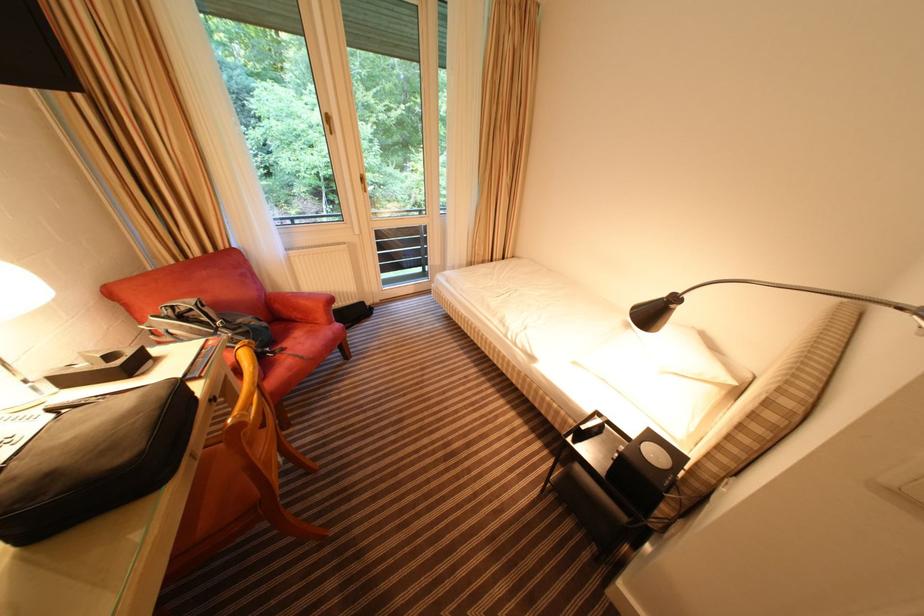
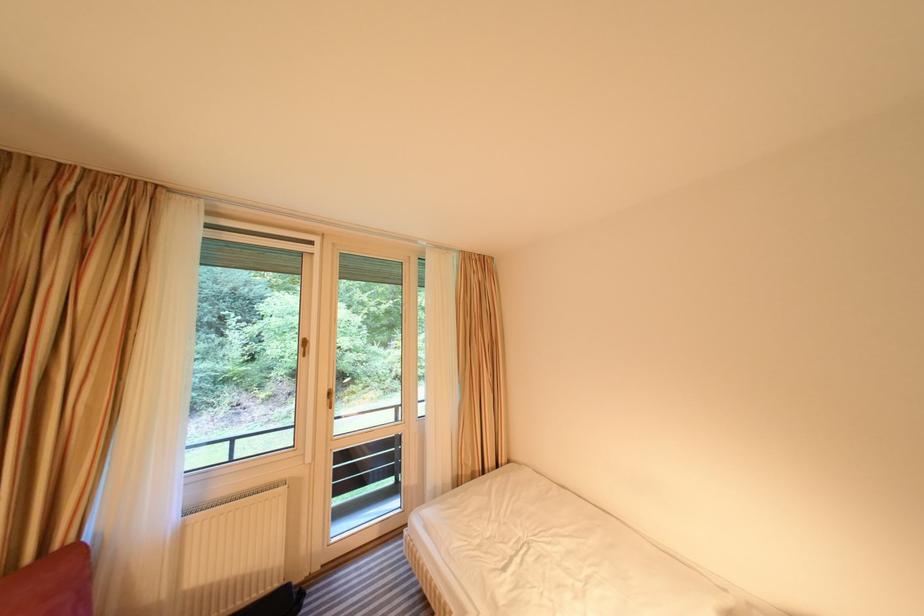
The point at (324, 121) is marked in the first image. Where is the corresponding point in the second image?

(300, 346)